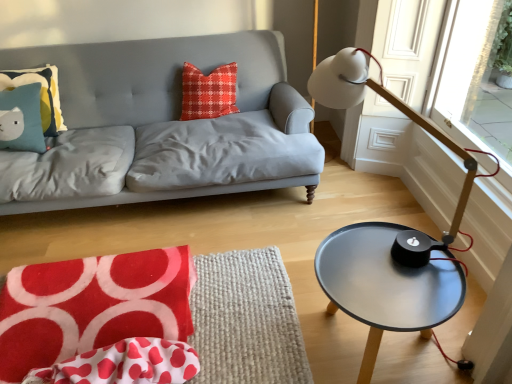
Question: From a real-world perspective, is velvety red swivel chair at lower left over metallic gray table at right?

Choices:
 (A) yes
 (B) no

Answer: (B)

Question: Is velvety red swivel chair at lower left outside metallic gray table at right?

Choices:
 (A) yes
 (B) no

Answer: (A)

Question: Would you say metallic gray table at right is part of velvety red swivel chair at lower left's contents?

Choices:
 (A) no
 (B) yes

Answer: (A)

Question: Is the depth of velvety red swivel chair at lower left less than that of metallic gray table at right?

Choices:
 (A) no
 (B) yes

Answer: (A)

Question: Does velvety red swivel chair at lower left have a greater height compared to metallic gray table at right?

Choices:
 (A) yes
 (B) no

Answer: (B)

Question: Is velvety red swivel chair at lower left positioned with its back to metallic gray table at right?

Choices:
 (A) no
 (B) yes

Answer: (A)

Question: Is red plaid pillow at center, the first pillow positioned from the right, oriented away from matte blue pillow with cat design at upper left, which is the second pillow from right to left?

Choices:
 (A) yes
 (B) no

Answer: (B)

Question: Is matte blue pillow with cat design at upper left, which is the first pillow in left-to-right order, inside red plaid pillow at center, which is the 2th pillow in left-to-right order?

Choices:
 (A) yes
 (B) no

Answer: (B)

Question: Is red plaid pillow at center, the first pillow positioned from the right, at the left side of matte blue pillow with cat design at upper left, which is the first pillow in left-to-right order?

Choices:
 (A) yes
 (B) no

Answer: (B)

Question: From a real-world perspective, does red plaid pillow at center, which is the 2th pillow in left-to-right order, sit lower than matte blue pillow with cat design at upper left, which is the first pillow in left-to-right order?

Choices:
 (A) no
 (B) yes

Answer: (B)

Question: Can you confirm if red plaid pillow at center, which is the 2th pillow in left-to-right order, is taller than matte blue pillow with cat design at upper left, which is the second pillow from right to left?

Choices:
 (A) no
 (B) yes

Answer: (A)

Question: Is red plaid pillow at center, the first pillow positioned from the right, positioned beyond the bounds of matte blue pillow with cat design at upper left, which is the first pillow in left-to-right order?

Choices:
 (A) no
 (B) yes

Answer: (B)

Question: Can you confirm if white polka dot fabric at lower left is bigger than matte blue pillow with cat design at upper left, which is the second pillow from right to left?

Choices:
 (A) yes
 (B) no

Answer: (B)